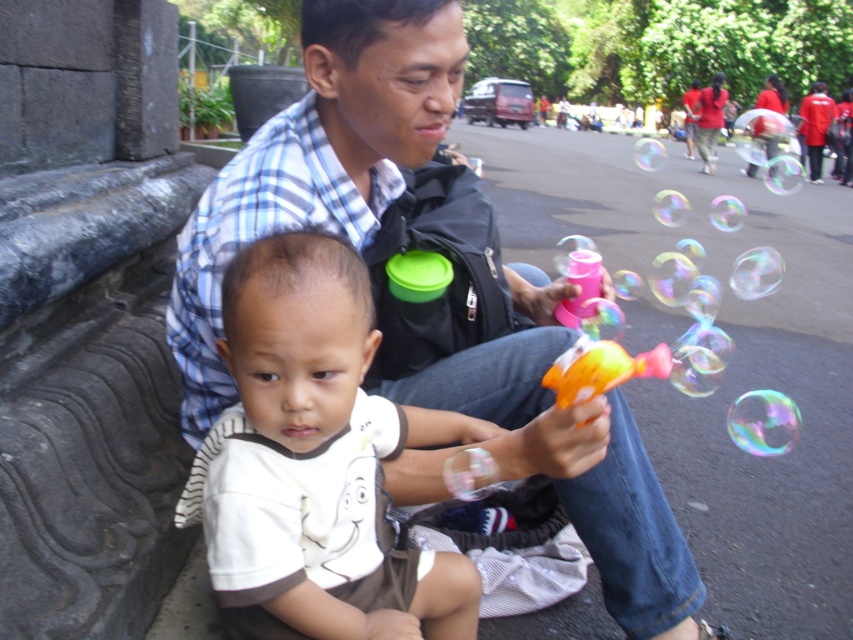
You are a fashion designer observing the scene. You notice the matte blue shirt at center and the white cotton shirt at center. Which shirt has a larger width when measured from left to right?

The matte blue shirt at center has a larger width than the white cotton shirt at center according to the description.